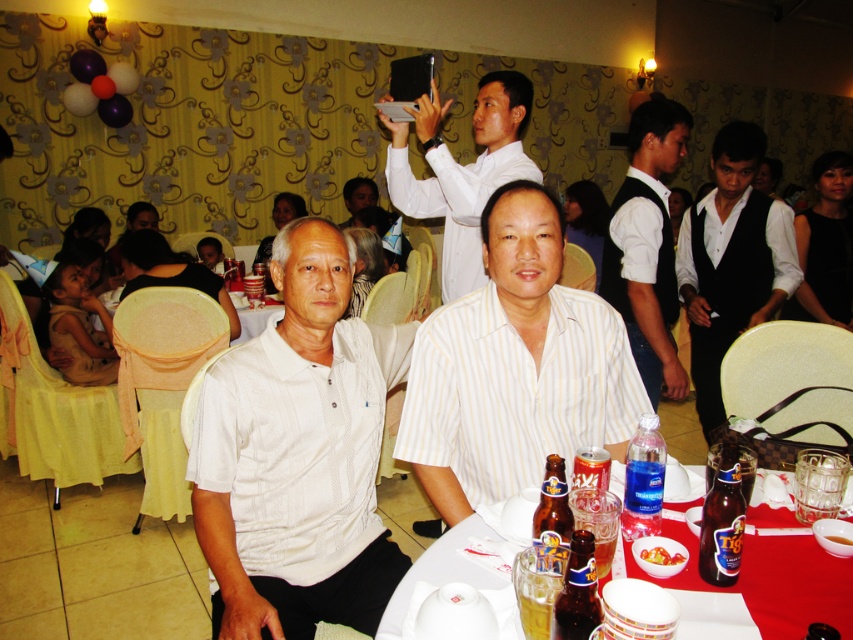
You are standing at the center of the banquet hall and see the point marked at coordinates (515, 368). What object is located at that point?

The point at coordinates (515, 368) corresponds to the white striped shirt at center.

You are a photographer at the event and need to adjust the lighting so that the white satin vest at right and the brown glass bottle at lower right are both visible. Which object should you focus on first to ensure proper exposure?

The white satin vest at right is much taller than the brown glass bottle at lower right, so you should focus on the white satin vest at right first to ensure proper exposure since it occupies more space and might require more attention in the lighting setup.